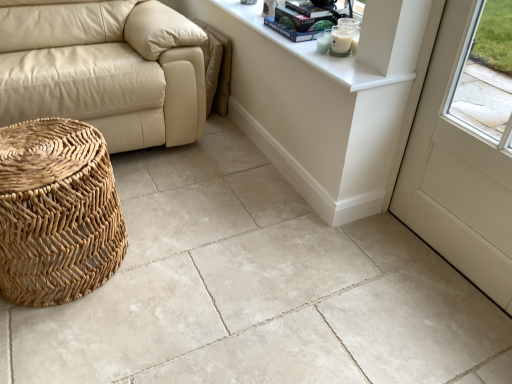
Locate an element on the screen. This screenshot has width=512, height=384. free point in front of natural woven basket at lower left is located at coordinates (70, 344).